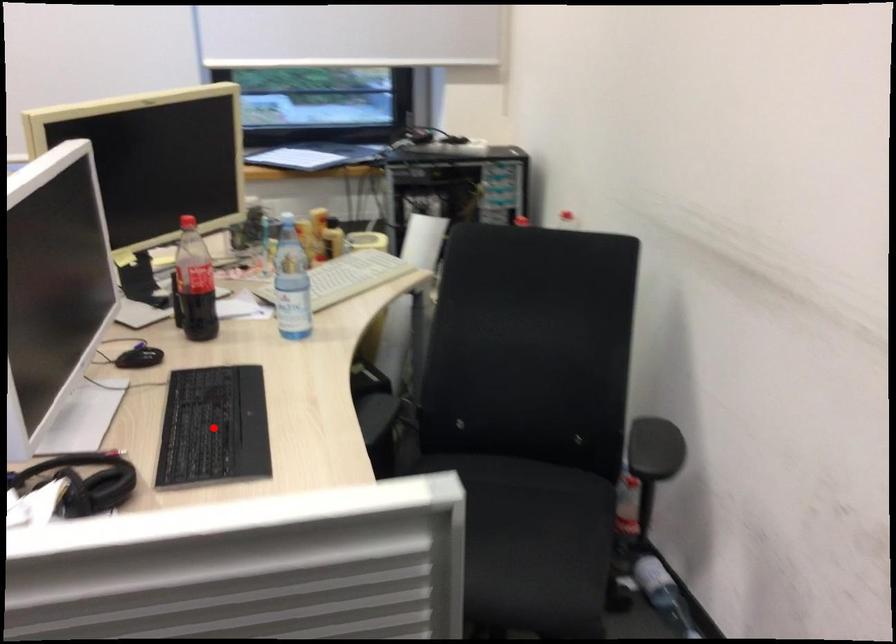
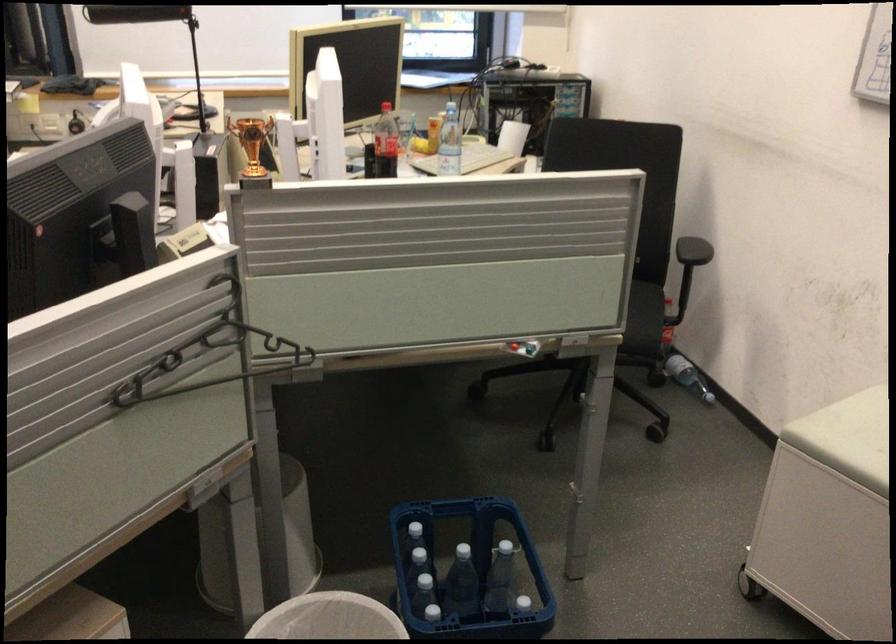
Question: I am providing you with two images of the same scene from different viewpoints. A red point is marked on the first image. Is the red point's position out of view in image 2?

Choices:
 (A) Yes
 (B) No

Answer: (A)